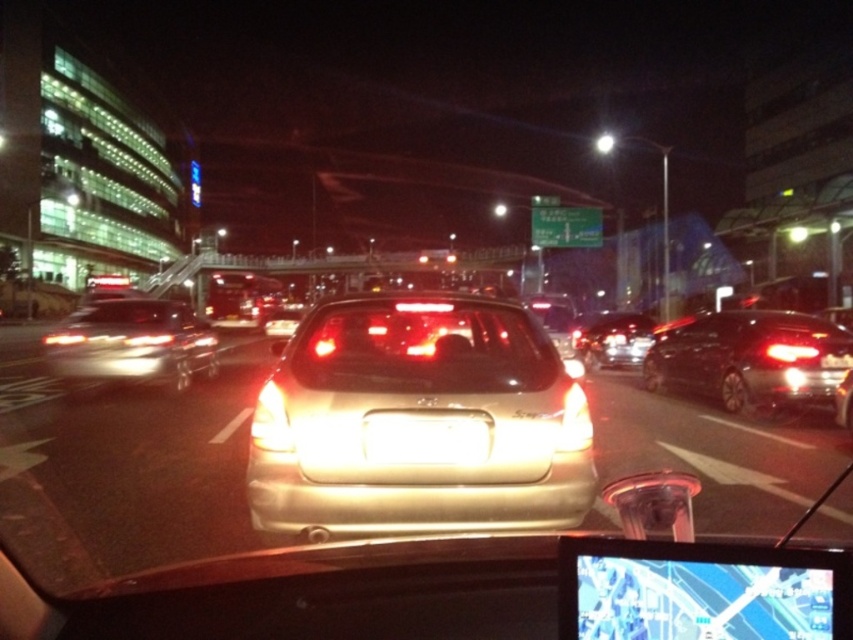
Between shiny silver sedan at left and shiny silver sedan at center, which one appears on the right side from the viewer's perspective?

Positioned to the right is shiny silver sedan at center.

Does shiny silver sedan at left have a greater width compared to shiny silver sedan at center?

Yes.

Is point (86, 342) farther from viewer compared to point (593, 348)?

No, it is not.

You are a GUI agent. You are given a task and a screenshot of the screen. Output one action in this format:
    pyautogui.click(x=<x>, y=<y>)
    Task: Click on the shiny silver sedan at left
    This screenshot has height=640, width=853.
    Given the screenshot: What is the action you would take?
    click(131, 342)

Is point (381, 352) positioned behind point (618, 342)?

No, (381, 352) is closer to viewer.

Can you confirm if transparent glass windshield at center is bigger than shiny silver sedan at center?

Yes, transparent glass windshield at center is bigger than shiny silver sedan at center.

Identify the location of transparent glass windshield at center. The width and height of the screenshot is (853, 640). (422, 348).

Is satin gold sedan at center smaller than transparent glass windshield at center?

Yes, satin gold sedan at center is smaller than transparent glass windshield at center.

Describe the element at coordinates (419, 422) in the screenshot. I see `satin gold sedan at center` at that location.

The width and height of the screenshot is (853, 640). Identify the location of satin gold sedan at center. (419, 422).